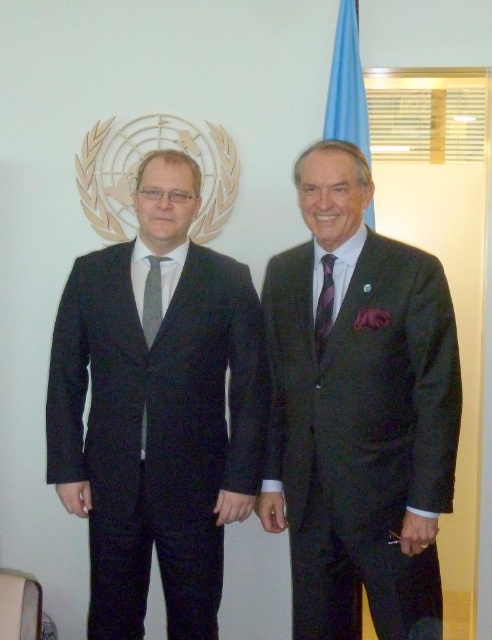
Can you confirm if black wool suit at center is smaller than gray textured tie at left?

No, black wool suit at center is not smaller than gray textured tie at left.

Between black wool suit at center and gray textured tie at left, which one is positioned lower?

black wool suit at center is below.

Locate an element on the screen. black wool suit at center is located at coordinates (157, 412).

Where is `black wool suit at center`? black wool suit at center is located at coordinates (157, 412).

Looking at this image, does dark grey textured suit at right appear on the right side of gray textured tie at left?

Correct, you'll find dark grey textured suit at right to the right of gray textured tie at left.

Between dark grey textured suit at right and gray textured tie at left, which one appears on the left side from the viewer's perspective?

gray textured tie at left

At what (x,y) coordinates should I click in order to perform the action: click on dark grey textured suit at right. Please return your answer as a coordinate pair (x, y). Looking at the image, I should click on (360, 413).

Which is more to the right, dark grey textured suit at right or purple striped tie at right?

dark grey textured suit at right is more to the right.

Does dark grey textured suit at right have a smaller size compared to purple striped tie at right?

No, dark grey textured suit at right is not smaller than purple striped tie at right.

Between point (399, 353) and point (332, 314), which one is positioned in front?

Point (399, 353) is more forward.

The height and width of the screenshot is (640, 492). Identify the location of dark grey textured suit at right. (360, 413).